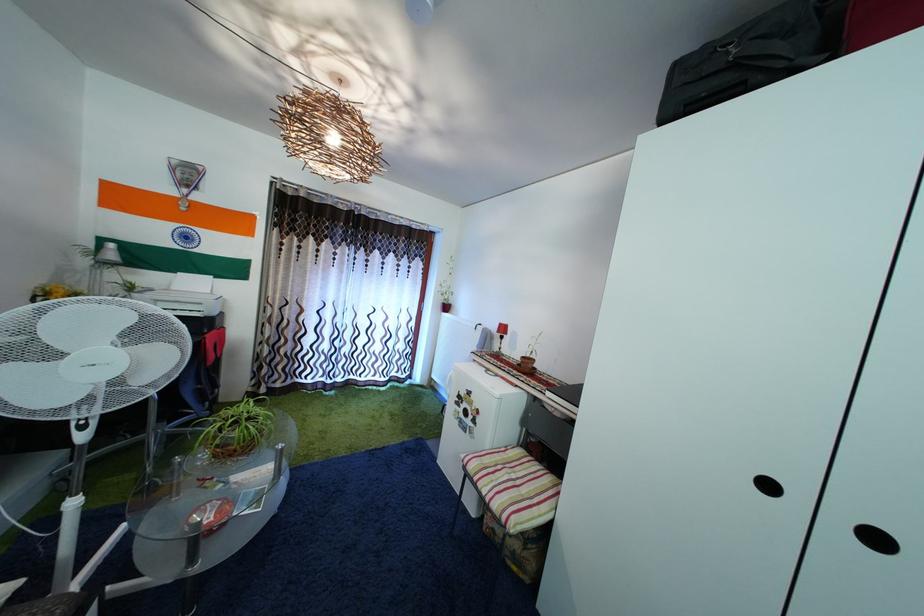
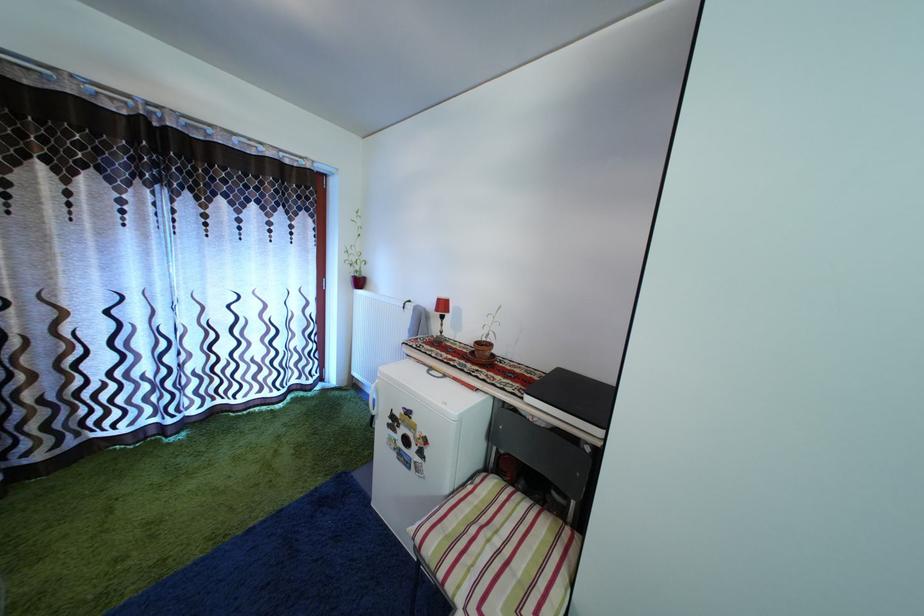
In the second image, find the point that corresponds to (531,365) in the first image.

(485, 350)